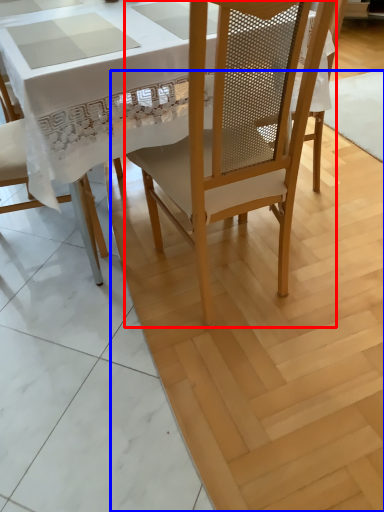
Question: Which point is closer to the camera, chair (highlighted by a red box) or plywood (highlighted by a blue box)?

Choices:
 (A) chair
 (B) plywood

Answer: (A)